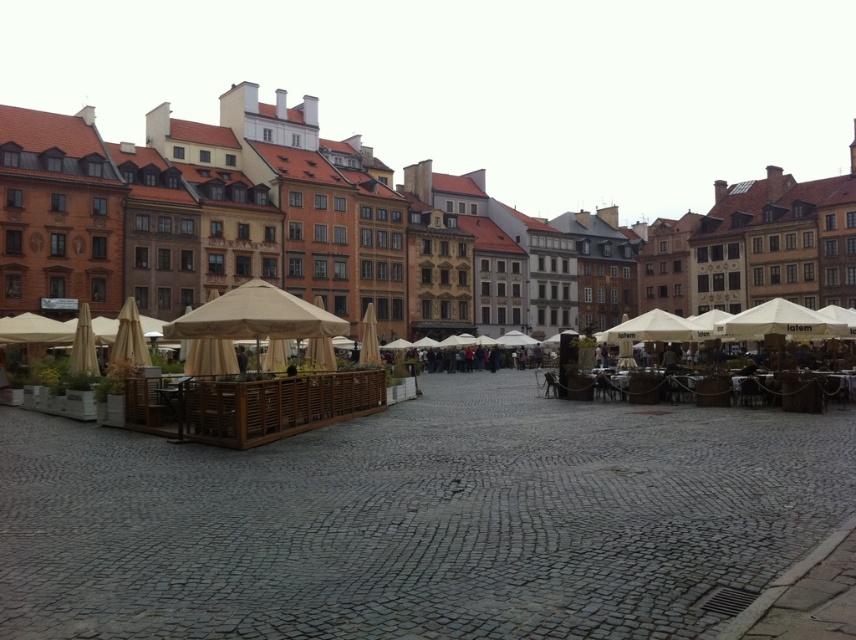
Question: Which point is closer to the camera?

Choices:
 (A) [x=735, y=326]
 (B) [x=777, y=220]

Answer: (A)

Question: Is beige fabric canopy at center in front of white fabric canopy at center?

Choices:
 (A) yes
 (B) no

Answer: (A)

Question: Is beige fabric umbrellas at center bigger than white fabric canopy at right?

Choices:
 (A) no
 (B) yes

Answer: (B)

Question: Among these objects, which one is nearest to the camera?

Choices:
 (A) white fabric canopy at center
 (B) white fabric canopy at right
 (C) beige fabric canopy at center
 (D) beige fabric umbrellas at center

Answer: (C)

Question: Where is beige fabric umbrellas at center located in relation to white fabric canopy at right in the image?

Choices:
 (A) below
 (B) above

Answer: (B)

Question: Which point appears closest to the camera in this image?

Choices:
 (A) (726, 333)
 (B) (251, 285)
 (C) (631, 305)

Answer: (B)